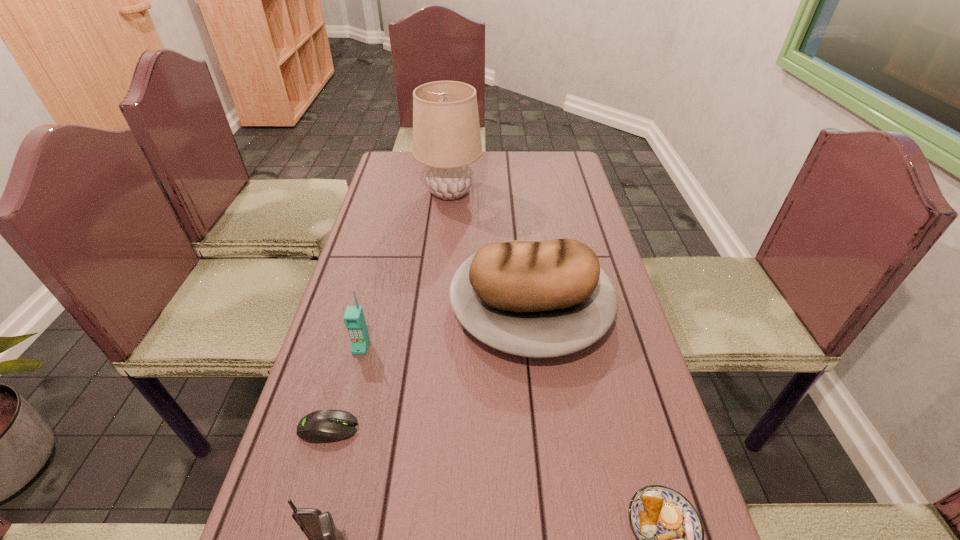
Find the location of a particular element. The width and height of the screenshot is (960, 540). free space between the farther cellular telephone and the computer mouse is located at coordinates (345, 388).

Identify the location of free area in between the tallest object and the farther cellular telephone. This screenshot has width=960, height=540. (405, 269).

What are the coordinates of `vacant space that's between the computer mouse and the lampshade` in the screenshot? It's located at (389, 310).

I want to click on free space that is in between the farther cellular telephone and the bread, so click(446, 326).

Find the location of a particular element. the closest object to the farther cellular telephone is located at coordinates (323, 426).

Where is `object that is the second closest to the farther cellular telephone`? This screenshot has height=540, width=960. object that is the second closest to the farther cellular telephone is located at coordinates (540, 299).

At what (x,y) coordinates should I click in order to perform the action: click on free space that satisfies the following two spatial constraints: 1. on the keypad of the farther cellular telephone; 2. on the wheel side of the shortest object. Please return your answer as a coordinate pair (x, y). Looking at the image, I should click on (341, 429).

You are a GUI agent. You are given a task and a screenshot of the screen. Output one action in this format:
    pyautogui.click(x=<x>, y=<y>)
    Task: Click on the free spot that satisfies the following two spatial constraints: 1. on the keypad of the farther cellular telephone; 2. on the wheel side of the computer mouse
    
    Given the screenshot: What is the action you would take?
    pyautogui.click(x=341, y=429)